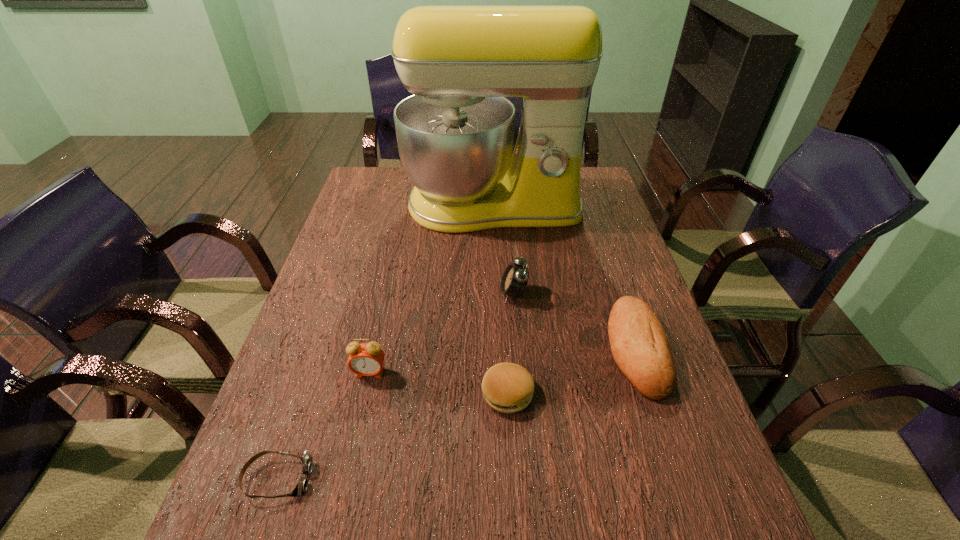
The image size is (960, 540). In order to click on free location that satisfies the following two spatial constraints: 1. on the side of the second shortest object with the control knob; 2. on the left side of the mixer in this screenshot , I will do `click(500, 393)`.

Where is `blank space that satisfies the following two spatial constraints: 1. on the face of the bread; 2. on the right side of the farther alarm clock`? blank space that satisfies the following two spatial constraints: 1. on the face of the bread; 2. on the right side of the farther alarm clock is located at coordinates (517, 349).

The height and width of the screenshot is (540, 960). Find the location of `free point that satisfies the following two spatial constraints: 1. on the face of the fifth nearest object; 2. on the face of the left alarm clock`. free point that satisfies the following two spatial constraints: 1. on the face of the fifth nearest object; 2. on the face of the left alarm clock is located at coordinates (519, 373).

This screenshot has height=540, width=960. What are the coordinates of `vacant region that satisfies the following two spatial constraints: 1. on the front side of the bread; 2. on the front-facing side of the goggles` in the screenshot? It's located at (679, 478).

Locate an element on the screen. free point that satisfies the following two spatial constraints: 1. on the side of the tallest object with the control knob; 2. on the right side of the bread is located at coordinates (498, 349).